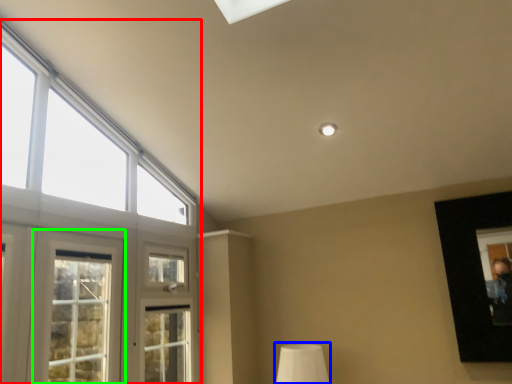
Question: Considering the real-world distances, which object is closest to window (highlighted by a red box)? table lamp (highlighted by a blue box) or window (highlighted by a green box).

Choices:
 (A) table lamp
 (B) window

Answer: (A)